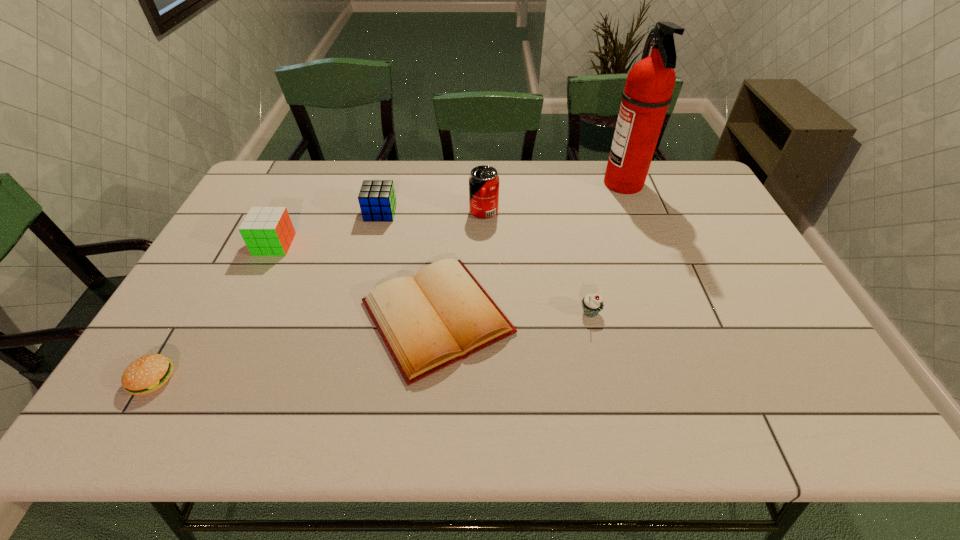
This screenshot has height=540, width=960. I want to click on free space in the image that satisfies the following two spatial constraints: 1. on the back side of the soda can; 2. on the right side of the farther cube, so click(381, 212).

Image resolution: width=960 pixels, height=540 pixels. In order to click on blank area in the image that satisfies the following two spatial constraints: 1. on the back side of the sixth shortest object; 2. on the right side of the leftmost object in this screenshot , I will do `click(251, 212)`.